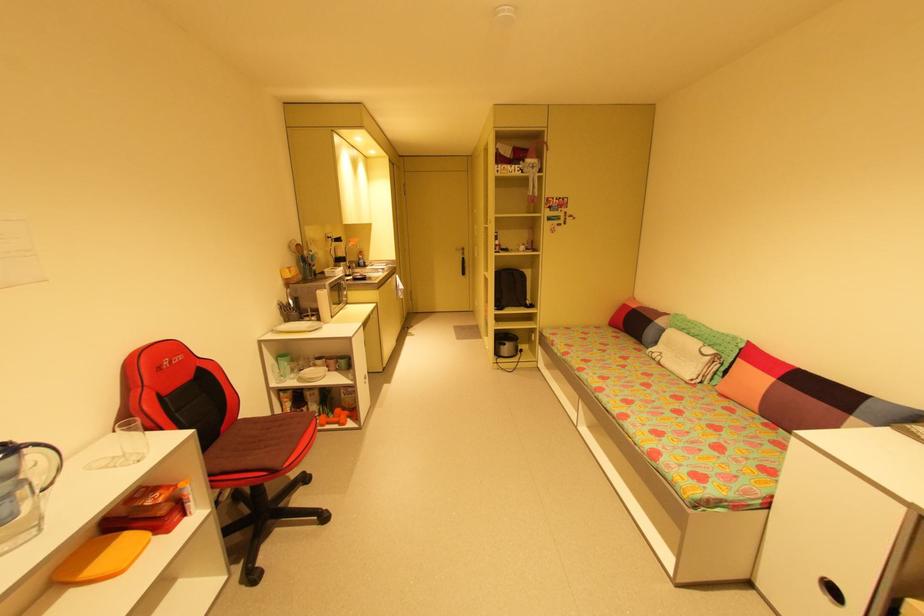
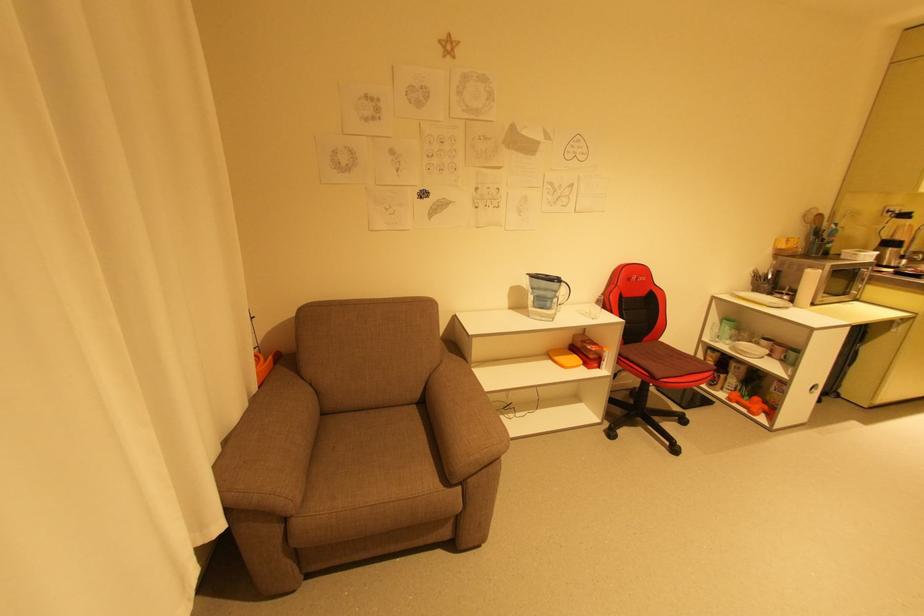
How did the camera likely rotate?

The camera rotated toward left-down.